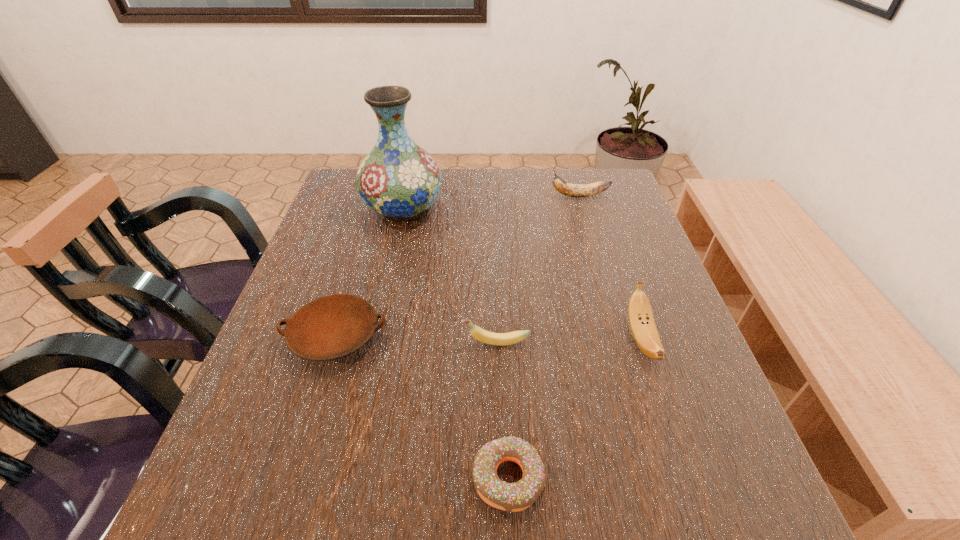
Locate an element on the screen. The height and width of the screenshot is (540, 960). vase is located at coordinates [x=398, y=179].

Locate an element on the screen. the farthest banana is located at coordinates (573, 190).

The image size is (960, 540). Find the location of `the shortest banana`. the shortest banana is located at coordinates (500, 339).

Locate an element on the screen. Image resolution: width=960 pixels, height=540 pixels. the fourth tallest object is located at coordinates (500, 339).

I want to click on plate, so click(x=330, y=327).

The image size is (960, 540). What are the coordinates of `doughnut` in the screenshot? It's located at (512, 497).

Locate an element on the screen. The width and height of the screenshot is (960, 540). vacant region located 0.130m on the front of the tallest object is located at coordinates (391, 265).

You are a GUI agent. You are given a task and a screenshot of the screen. Output one action in this format:
    pyautogui.click(x=<x>, y=<y>)
    Task: Click on the vacant space located 0.200m on the peel of the farthest banana
    This screenshot has width=960, height=540.
    Given the screenshot: What is the action you would take?
    pyautogui.click(x=481, y=196)

This screenshot has width=960, height=540. I want to click on vacant point located on the peel of the farthest banana, so click(422, 196).

Where is `vacant space located 0.090m on the peel of the farthest banana`? vacant space located 0.090m on the peel of the farthest banana is located at coordinates (x=518, y=196).